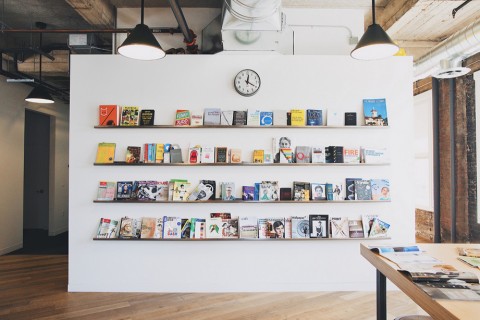
Find the location of a particular element. This screenshot has height=320, width=480. shelf is located at coordinates (120, 128), (120, 164), (115, 203), (117, 240).